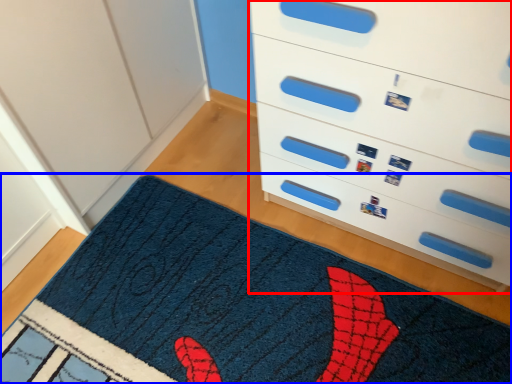
Question: Which of the following is the farthest to the observer, chest of drawers (highlighted by a red box) or mat (highlighted by a blue box)?

Choices:
 (A) chest of drawers
 (B) mat

Answer: (B)